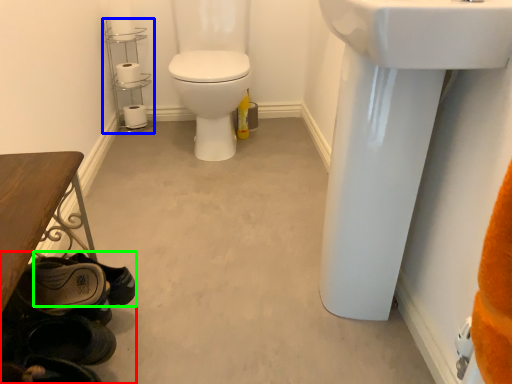
Question: Which object is positioned farthest from shoe (highlighted by a red box)? Select from shelf (highlighted by a blue box) and shoe (highlighted by a green box).

Choices:
 (A) shelf
 (B) shoe

Answer: (A)